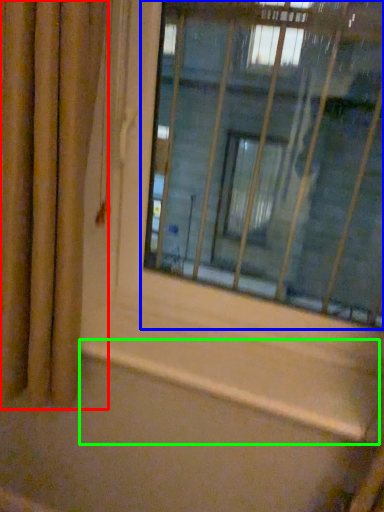
Question: Considering the real-world distances, which object is closest to curtain (highlighted by a red box)? window (highlighted by a blue box) or window sill (highlighted by a green box).

Choices:
 (A) window
 (B) window sill

Answer: (B)